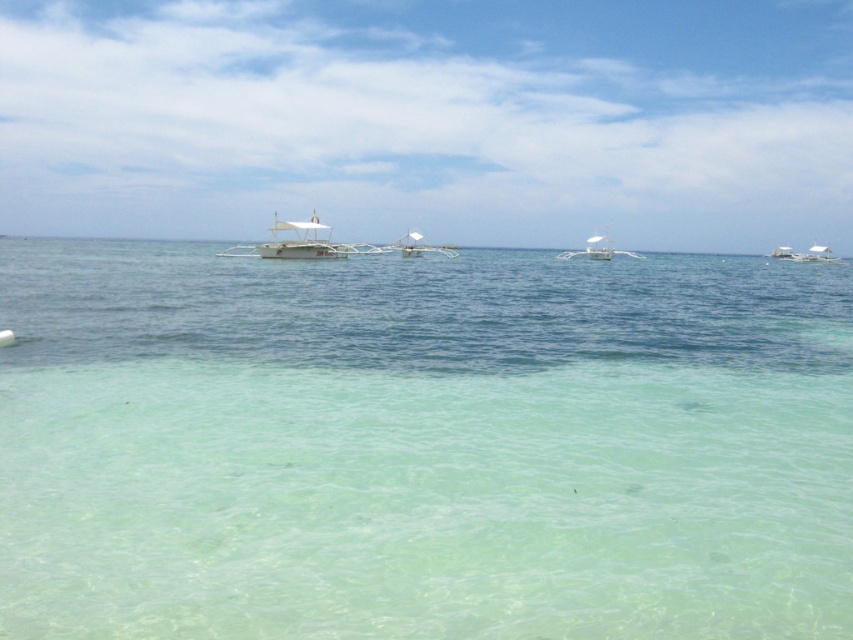
Question: Among these objects, which one is nearest to the camera?

Choices:
 (A) clear water at center
 (B) white glossy boat at center

Answer: (A)

Question: Is white matte boat at center to the right of white plastic boat at right from the viewer's perspective?

Choices:
 (A) yes
 (B) no

Answer: (B)

Question: Can you confirm if white matte boat at center is positioned to the right of white wooden boat at center?

Choices:
 (A) no
 (B) yes

Answer: (A)

Question: Is white matte boat at center bigger than white glossy boat at center?

Choices:
 (A) no
 (B) yes

Answer: (B)

Question: Which object is the closest to the white plastic boat at right?

Choices:
 (A) clear water at center
 (B) white matte boat at center
 (C) white wooden boat at center
 (D) white glossy boat at center

Answer: (D)

Question: Which object is the closest to the white wooden boat at center?

Choices:
 (A) white glossy boat at center
 (B) white matte boat at center
 (C) white plastic boat at right
 (D) clear water at center

Answer: (A)